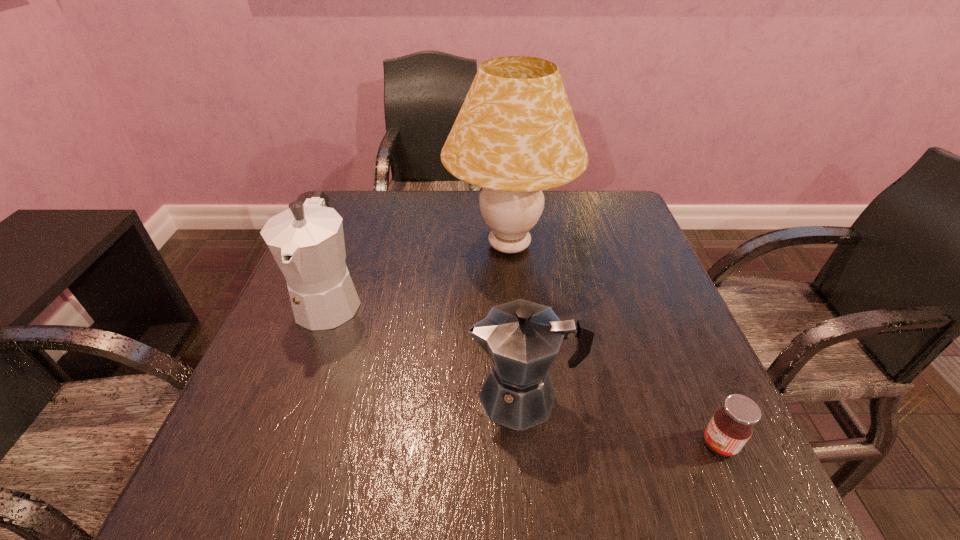
You are a GUI agent. You are given a task and a screenshot of the screen. Output one action in this format:
    pyautogui.click(x=<x>, y=<y>)
    Task: Click on the lampshade
    The width and height of the screenshot is (960, 540).
    Given the screenshot: What is the action you would take?
    pyautogui.click(x=515, y=135)

I want to click on the leftmost object, so click(x=307, y=241).

In order to click on the farther coffeepot in this screenshot , I will do `click(307, 241)`.

Identify the location of the nearer coffeepot. (522, 338).

Image resolution: width=960 pixels, height=540 pixels. I want to click on the shorter coffeepot, so click(522, 338).

This screenshot has width=960, height=540. I want to click on the shortest object, so click(x=731, y=426).

Identify the location of jam. (731, 426).

The width and height of the screenshot is (960, 540). Identify the location of vacant space situated 0.260m on the front of the lampshade. (520, 383).

Where is `vacant area located 0.150m at the spout of the left coffeepot`? vacant area located 0.150m at the spout of the left coffeepot is located at coordinates (290, 407).

The image size is (960, 540). I want to click on free spot located at the spout of the third tallest object, so (335, 396).